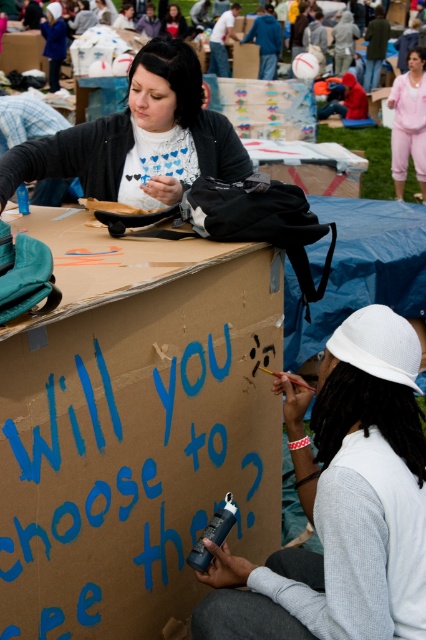
Question: Does pink cotton pants at upper right come in front of matte black shirt at upper center?

Choices:
 (A) yes
 (B) no

Answer: (A)

Question: Is the position of white mesh hat at upper right less distant than that of matte black shirt at upper center?

Choices:
 (A) yes
 (B) no

Answer: (A)

Question: Which point is closer to the camera?

Choices:
 (A) white mesh hat at upper right
 (B) blue cardboard box at center
 (C) pink cotton pants at upper right

Answer: (B)

Question: Among these objects, which one is farthest from the camera?

Choices:
 (A) blue cardboard box at center
 (B) white mesh hat at upper right

Answer: (B)

Question: Which object is positioned closest to the matte black shirt at upper center?

Choices:
 (A) blue cardboard box at center
 (B) pink cotton pants at upper right
 (C) white matte sweater at upper center
 (D) white mesh hat at upper right

Answer: (B)

Question: Is blue cardboard box at center thinner than white matte sweater at upper center?

Choices:
 (A) no
 (B) yes

Answer: (A)